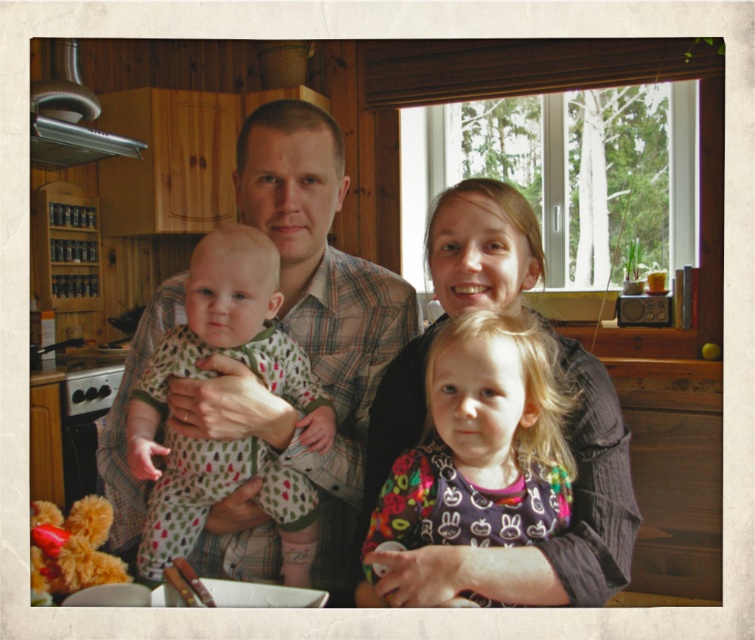
Question: Which of the following is the farthest from the observer?

Choices:
 (A) printed cotton onesie at center
 (B) plaid shirt at center

Answer: (B)

Question: Which is farther from the printed cotton onesie at center?

Choices:
 (A) plaid shirt at center
 (B) matte black shirt at center

Answer: (B)

Question: Does plaid shirt at center have a lesser width compared to matte black shirt at center?

Choices:
 (A) yes
 (B) no

Answer: (B)

Question: Can you confirm if plaid shirt at center is positioned to the right of matte black shirt at center?

Choices:
 (A) no
 (B) yes

Answer: (A)

Question: From the image, what is the correct spatial relationship of plaid shirt at center in relation to matte black shirt at center?

Choices:
 (A) right
 (B) left

Answer: (B)

Question: Among these objects, which one is nearest to the camera?

Choices:
 (A) printed cotton onesie at center
 (B) matte black shirt at center

Answer: (B)